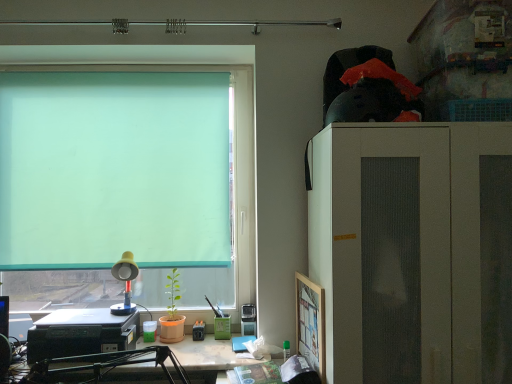
The height and width of the screenshot is (384, 512). Identify the location of blank area beneath yellow plastic lamp at lower left (from a real-world perspective). (128, 311).